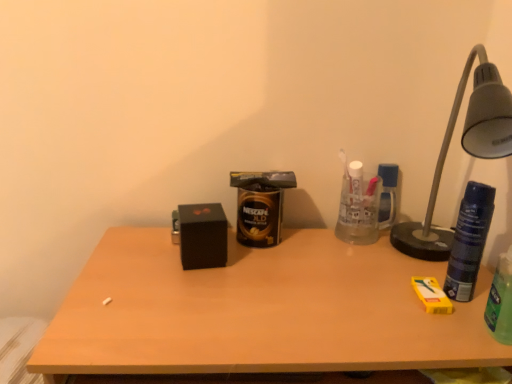
Find the location of `vacant space in front of blue textured can at right, the 2th beverage in the right-to-left sequence`. vacant space in front of blue textured can at right, the 2th beverage in the right-to-left sequence is located at coordinates [458, 332].